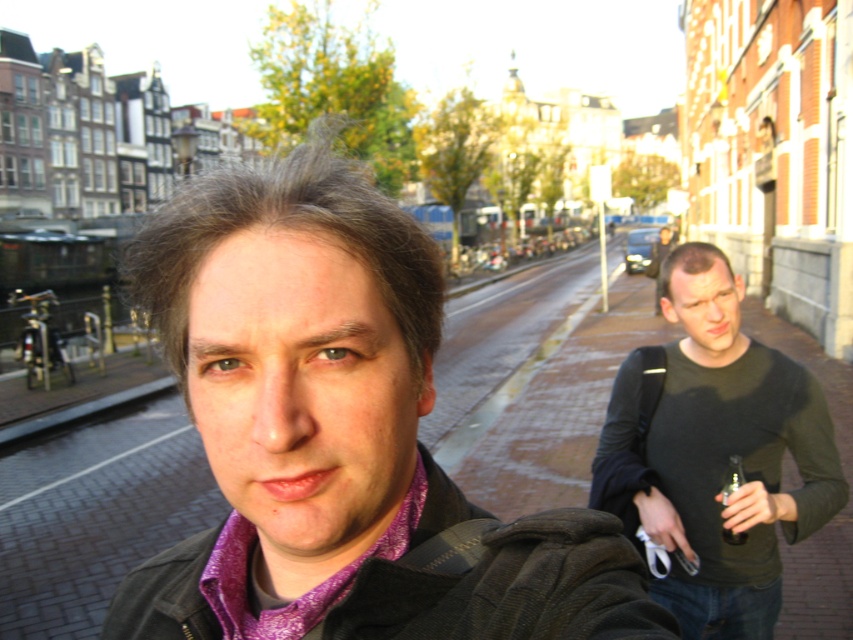
Who is higher up, dark green sweater at right or clear plastic bottle at center?

dark green sweater at right

Is dark green sweater at right below clear plastic bottle at center?

Incorrect, dark green sweater at right is not positioned below clear plastic bottle at center.

The height and width of the screenshot is (640, 853). What do you see at coordinates (717, 454) in the screenshot? I see `dark green sweater at right` at bounding box center [717, 454].

Locate an element on the screen. dark green sweater at right is located at coordinates (717, 454).

Is purple woven shirt at center taller than purple patterned scarf at center?

Indeed, purple woven shirt at center has a greater height compared to purple patterned scarf at center.

Is purple woven shirt at center below purple patterned scarf at center?

No, purple woven shirt at center is not below purple patterned scarf at center.

Who is more forward, (x=318, y=417) or (x=244, y=525)?

Point (x=318, y=417)

The image size is (853, 640). Identify the location of purple woven shirt at center. (337, 433).

Who is shorter, dark green sweater at right or purple patterned scarf at center?

purple patterned scarf at center

From the picture: Is dark green sweater at right thinner than purple patterned scarf at center?

In fact, dark green sweater at right might be wider than purple patterned scarf at center.

Who is more distant from viewer, (648, 488) or (221, 547)?

The point (648, 488) is more distant.

Locate an element on the screen. Image resolution: width=853 pixels, height=640 pixels. dark green sweater at right is located at coordinates (717, 454).